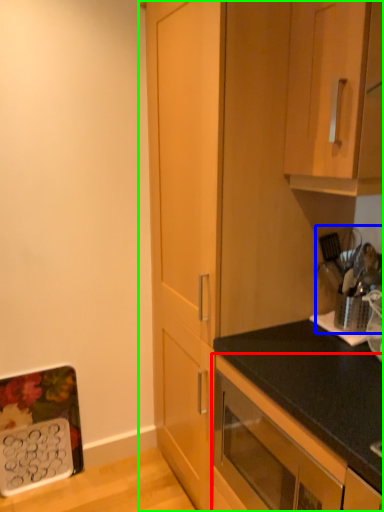
Question: Which is farther away from cabinetry (highlighted by a red box)? appliance (highlighted by a blue box) or cabinetry (highlighted by a green box)?

Choices:
 (A) appliance
 (B) cabinetry

Answer: (A)